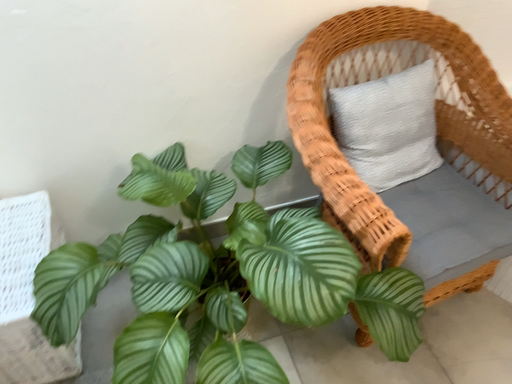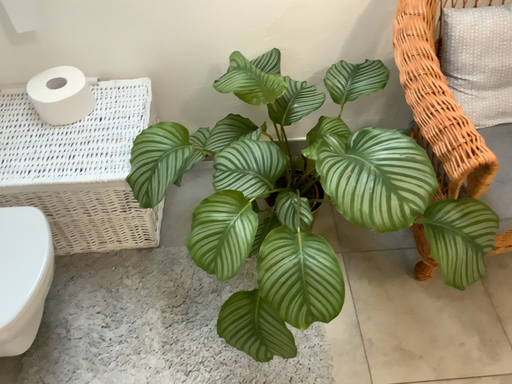
Question: How did the camera likely rotate when shooting the video?

Choices:
 (A) rotated downward
 (B) rotated upward

Answer: (A)